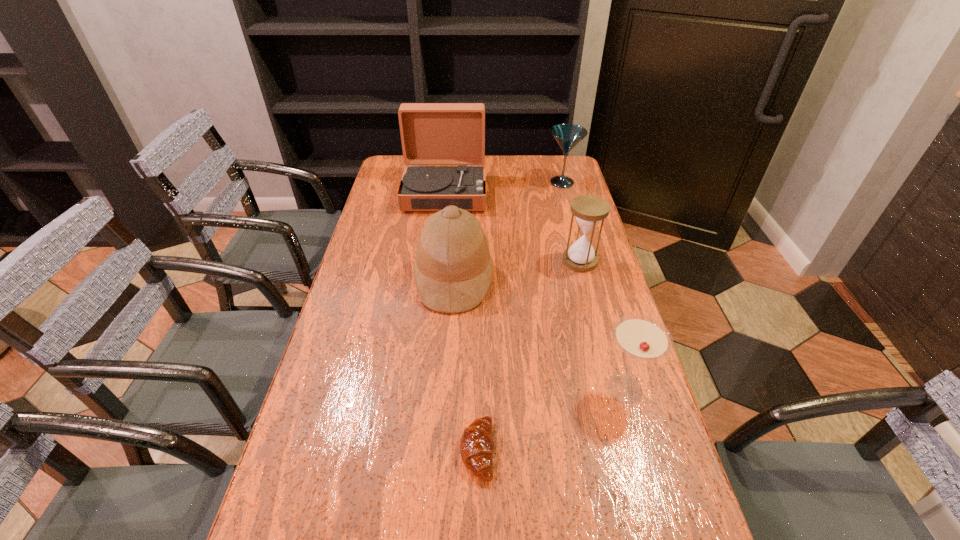
At what (x,y) coordinates should I click in order to perform the action: click on vacant space located on the left of the hourglass. Please return your answer as a coordinate pair (x, y). Looking at the image, I should click on (448, 261).

Where is `free space located 0.370m on the left of the fifth farthest object`? Image resolution: width=960 pixels, height=540 pixels. free space located 0.370m on the left of the fifth farthest object is located at coordinates (441, 389).

Image resolution: width=960 pixels, height=540 pixels. Find the location of `vacant space situated on the right of the crescent roll`. vacant space situated on the right of the crescent roll is located at coordinates (660, 451).

Identify the location of phonograph record located at the far edge. (431, 133).

I want to click on martini that is positioned at the far edge, so click(x=567, y=136).

Find the location of `object present at the left edge`. object present at the left edge is located at coordinates (431, 133).

At what (x,y) coordinates should I click in order to perform the action: click on hourglass at the right edge. Please return your answer as a coordinate pair (x, y). The height and width of the screenshot is (540, 960). Looking at the image, I should click on (589, 211).

Where is `object that is at the far left corner`? Image resolution: width=960 pixels, height=540 pixels. object that is at the far left corner is located at coordinates (431, 133).

The height and width of the screenshot is (540, 960). I want to click on object that is at the far right corner, so click(x=567, y=136).

Find the location of a particular element. This screenshot has height=540, width=960. free point at the far edge is located at coordinates (494, 158).